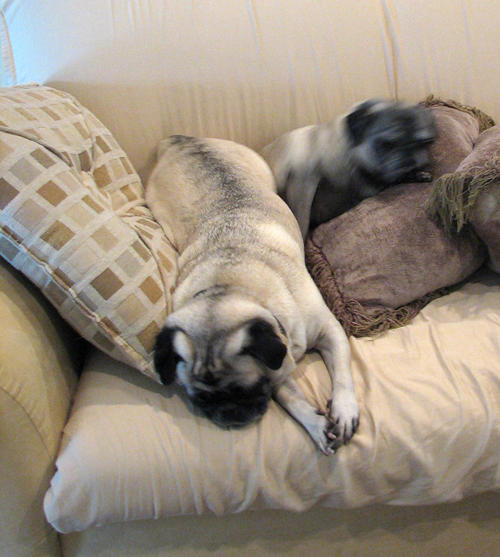
Image resolution: width=500 pixels, height=557 pixels. What are the coordinates of `4 pillows` in the screenshot? It's located at (458, 115), (476, 159), (423, 226), (106, 213).